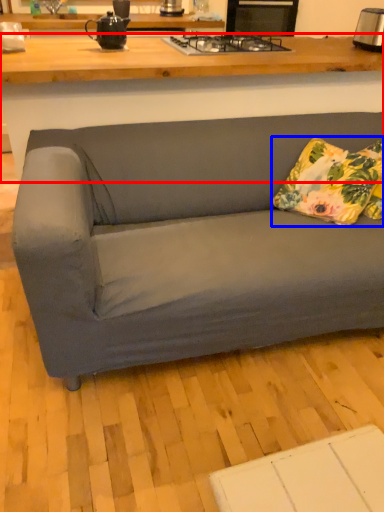
Question: Among these objects, which one is farthest to the camera, desk (highlighted by a red box) or pillow (highlighted by a blue box)?

Choices:
 (A) desk
 (B) pillow

Answer: (B)